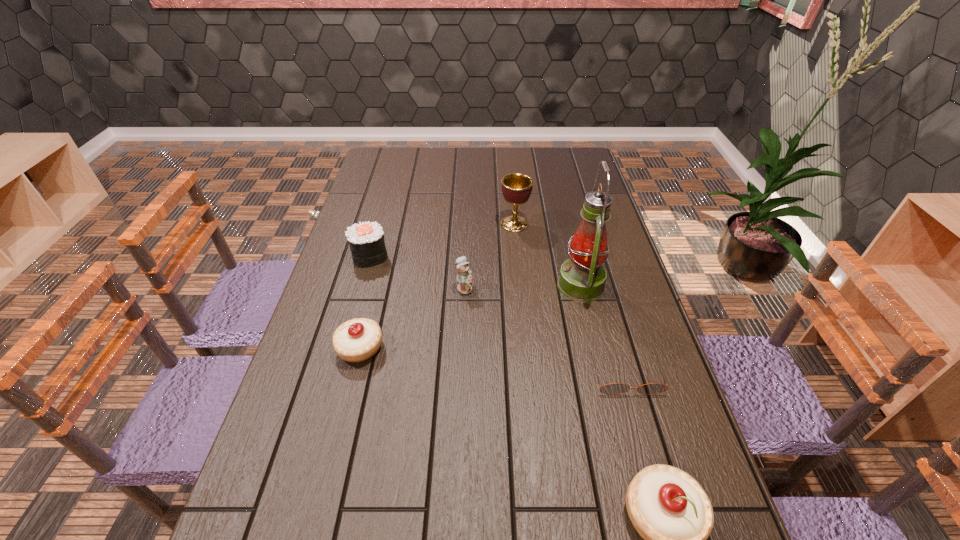
What are the coordinates of `the second shortest object` in the screenshot? It's located at (357, 340).

Locate an element on the screen. The height and width of the screenshot is (540, 960). the shorter pastry is located at coordinates (357, 340).

Image resolution: width=960 pixels, height=540 pixels. What are the coordinates of `the farthest object` in the screenshot? It's located at (516, 187).

Find the location of a particular element. The width and height of the screenshot is (960, 540). the sixth shortest object is located at coordinates (516, 187).

You are a GUI agent. You are given a task and a screenshot of the screen. Output one action in this format:
    pyautogui.click(x=<x>, y=<y>)
    Task: Click on the teddy bear
    This screenshot has height=540, width=960.
    Given the screenshot: What is the action you would take?
    pyautogui.click(x=464, y=278)

Find the location of a particular element. Image resolution: width=960 pixels, height=540 pixels. oil lamp is located at coordinates (x=582, y=278).

Find the location of a particular element. The width and height of the screenshot is (960, 540). sushi is located at coordinates [366, 240].

This screenshot has height=540, width=960. I want to click on sunglasses, so click(615, 388).

I want to click on vacant space located 0.230m on the right of the left pastry, so click(x=473, y=348).

Identify the location of vacant space located 0.250m on the left of the sixth shortest object. Image resolution: width=960 pixels, height=540 pixels. (427, 224).